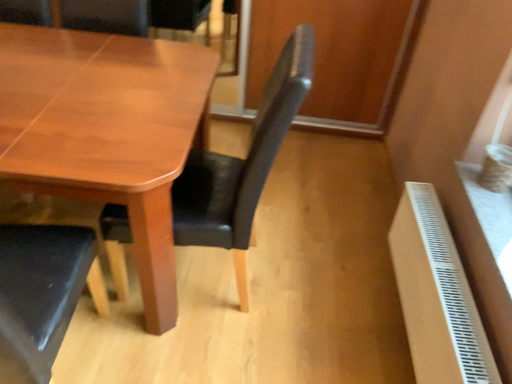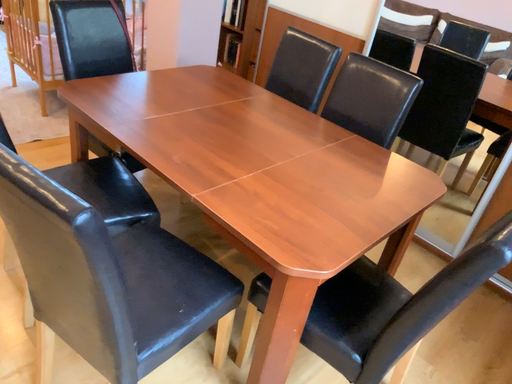
Question: Which way did the camera rotate in the video?

Choices:
 (A) rotated left
 (B) rotated right

Answer: (A)